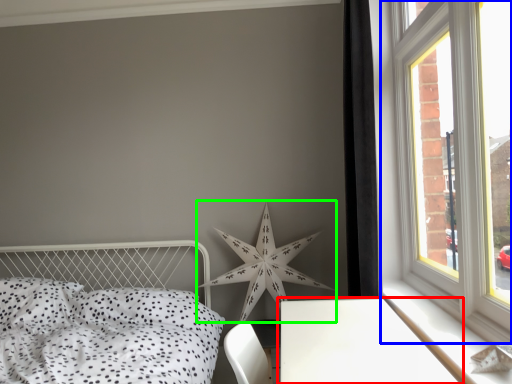
Question: Which object is positioned farthest from table (highlighted by a red box)? Select from window (highlighted by a blue box) and star (highlighted by a green box).

Choices:
 (A) window
 (B) star

Answer: (B)